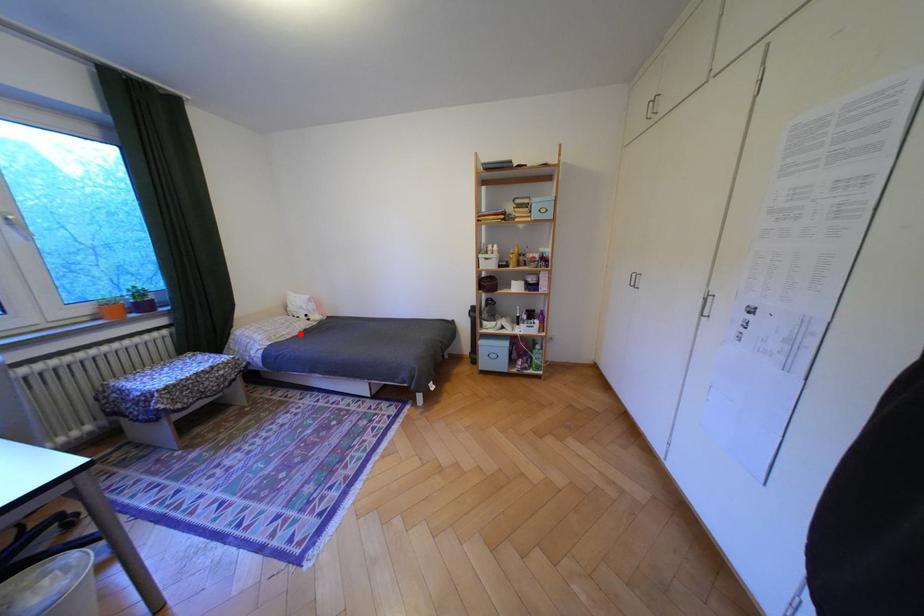
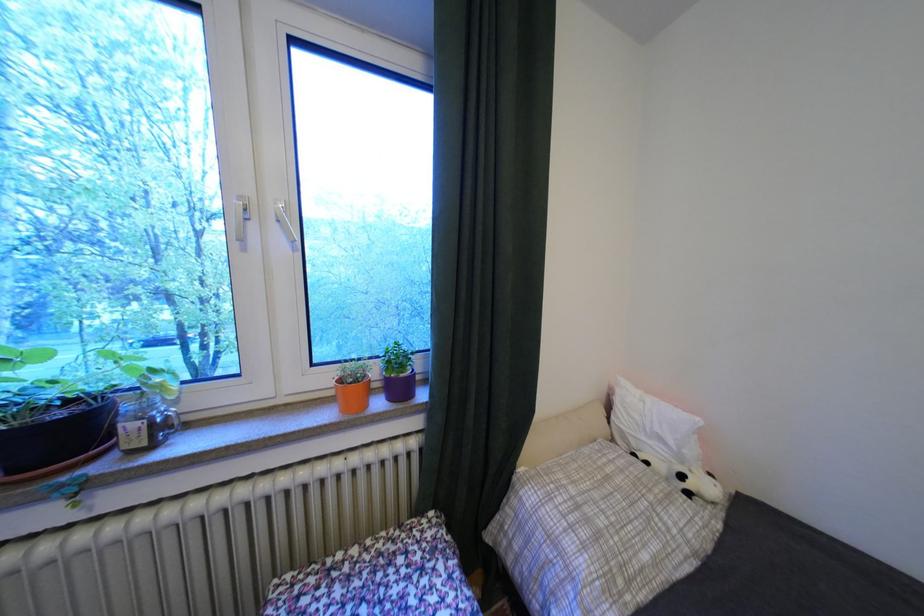
Where in the second image is the point corresponding to the highlighted location from the first image?

(667, 562)